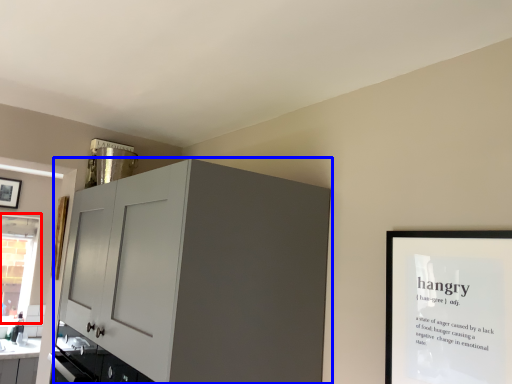
Question: Which object is closer to the camera taking this photo, window (highlighted by a red box) or cabinetry (highlighted by a blue box)?

Choices:
 (A) window
 (B) cabinetry

Answer: (B)